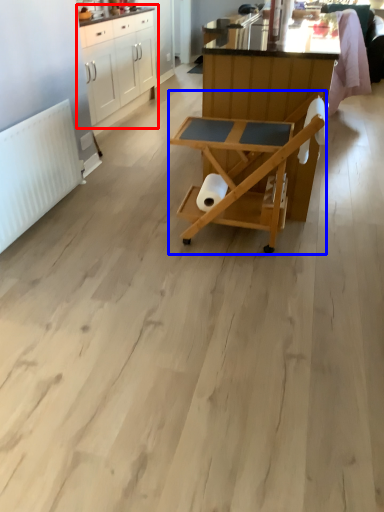
Question: Which object appears farthest to the camera in this image, cabinetry (highlighted by a red box) or table (highlighted by a blue box)?

Choices:
 (A) cabinetry
 (B) table

Answer: (A)